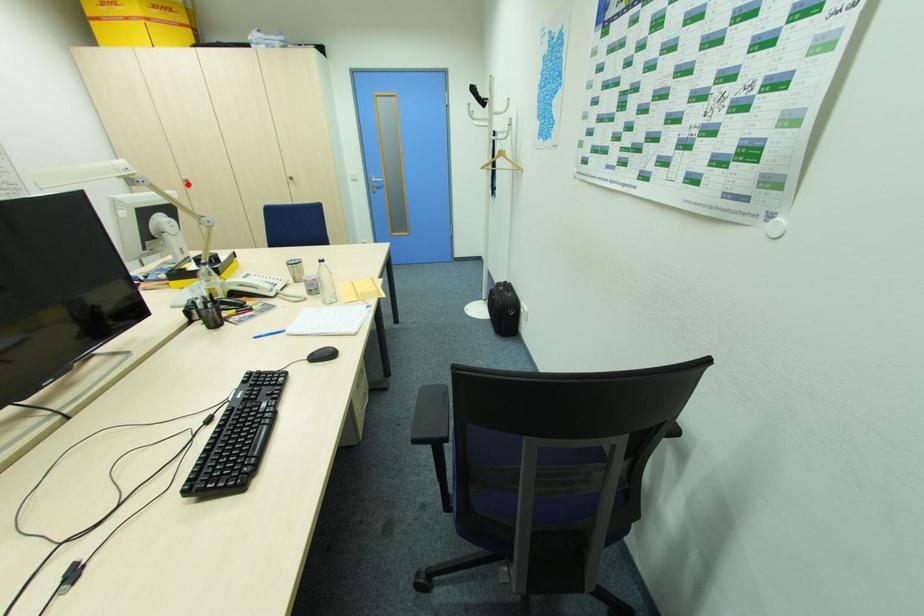
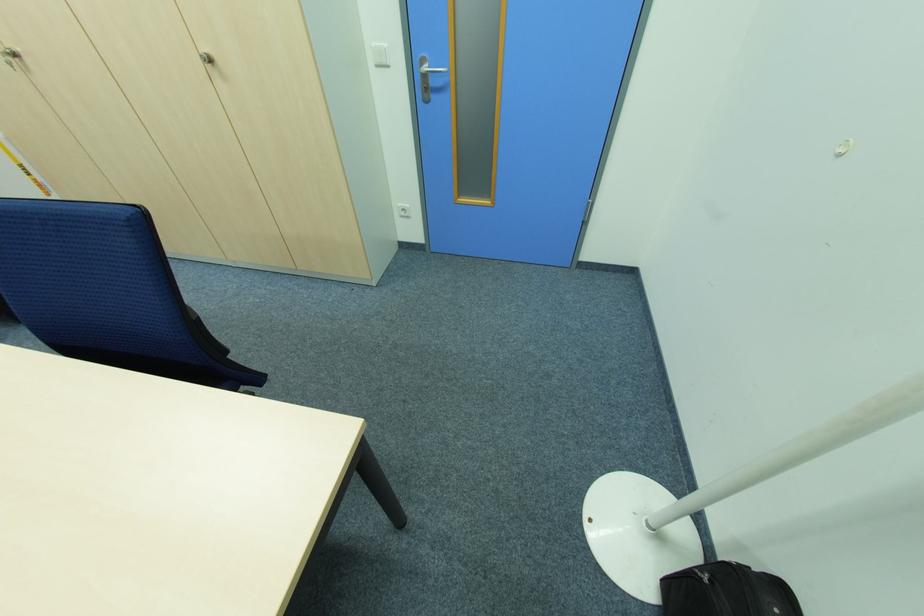
Locate, in the second image, the point that corresponds to the highlighted location in the first image.

(14, 65)